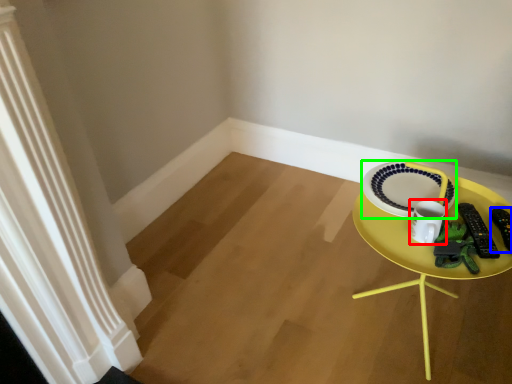
Question: Based on their relative distances, which object is nearer to coffee cup (highlighted by a red box)? Choose from remote control (highlighted by a blue box) and plate (highlighted by a green box).

Choices:
 (A) remote control
 (B) plate

Answer: (B)